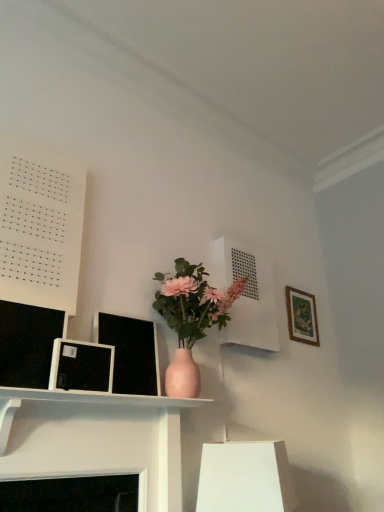
This screenshot has height=512, width=384. What are the coordinates of `matte white shelf at center, placed as the 2th shelf when sorted from back to front` in the screenshot? It's located at (96, 439).

Find the location of a particular element. white matte vent at upper center, which is the first shelf in right-to-left order is located at coordinates (247, 295).

At what (x,y) coordinates should I click in order to perform the action: click on wooden picture frame at upper right, which ranks as the 2th picture frame in front-to-back order. Please return your answer as a coordinate pair (x, y). Looking at the image, I should click on pyautogui.click(x=302, y=317).

Where is `matte black picture frame at left, placed as the second picture frame when sorted from back to front`? This screenshot has width=384, height=512. matte black picture frame at left, placed as the second picture frame when sorted from back to front is located at coordinates (81, 366).

Is wooden picture frame at upper right, which ranks as the 2th picture frame in front-to-back order, oriented away from matte black picture frame at left, placed as the first picture frame when sorted from left to right?

No.

Is wooden picture frame at upper right, which ranks as the 2th picture frame in front-to-back order, wider or thinner than matte black picture frame at left, the second picture frame when ordered from right to left?

Clearly, wooden picture frame at upper right, which ranks as the 2th picture frame in front-to-back order, has less width compared to matte black picture frame at left, the second picture frame when ordered from right to left.

Is wooden picture frame at upper right, positioned as the first picture frame in back-to-front order, bigger than matte black picture frame at left, the second picture frame when ordered from right to left?

Yes.

Which object is wider, white matte vent at upper center, which is the 2th shelf from left to right, or matte white shelf at center, placed as the 2th shelf when sorted from back to front?

With larger width is matte white shelf at center, placed as the 2th shelf when sorted from back to front.

Is white matte vent at upper center, which is the 2th shelf from left to right, far away from matte white shelf at center, the first shelf in the left-to-right sequence?

No, white matte vent at upper center, which is the 2th shelf from left to right, is in close proximity to matte white shelf at center, the first shelf in the left-to-right sequence.

Is white matte vent at upper center, the second shelf viewed from the front, positioned with its back to matte white shelf at center, the first shelf from the front?

No.

Which point is more distant from viewer, (254, 311) or (40, 462)?

The point (254, 311) is more distant.

Are wooden picture frame at upper right, the first picture frame positioned from the right, and white matte vent at upper center, acting as the first shelf starting from the back, making contact?

No, wooden picture frame at upper right, the first picture frame positioned from the right, is not touching white matte vent at upper center, acting as the first shelf starting from the back.

Between wooden picture frame at upper right, the first picture frame positioned from the right, and white matte vent at upper center, the second shelf viewed from the front, which one has smaller size?

wooden picture frame at upper right, the first picture frame positioned from the right, is smaller.

How different are the orientations of wooden picture frame at upper right, which ranks as the 2th picture frame in front-to-back order, and white matte vent at upper center, acting as the first shelf starting from the back, in degrees?

The angle between the facing direction of wooden picture frame at upper right, which ranks as the 2th picture frame in front-to-back order, and the facing direction of white matte vent at upper center, acting as the first shelf starting from the back, is 1.05 degrees.

Based on the photo, is wooden picture frame at upper right, the first picture frame positioned from the right, looking in the opposite direction of white matte vent at upper center, the second shelf viewed from the front?

No, white matte vent at upper center, the second shelf viewed from the front, is not at the back of wooden picture frame at upper right, the first picture frame positioned from the right.

From the picture: Is matte white shelf at center, the first shelf from the front, outside of white paper at upper left?

Absolutely, matte white shelf at center, the first shelf from the front, is external to white paper at upper left.

Is matte white shelf at center, the first shelf in the left-to-right sequence, at the right side of white paper at upper left?

Yes.

Considering the sizes of matte white shelf at center, the first shelf in the left-to-right sequence, and white paper at upper left in the image, is matte white shelf at center, the first shelf in the left-to-right sequence, bigger or smaller than white paper at upper left?

matte white shelf at center, the first shelf in the left-to-right sequence, is bigger than white paper at upper left.

This screenshot has width=384, height=512. In order to click on shelf in front of the white paper at upper left in this screenshot , I will do `click(96, 439)`.

Does white paper at upper left have a lesser height compared to wooden picture frame at upper right, positioned as the first picture frame in back-to-front order?

Incorrect, the height of white paper at upper left does not fall short of that of wooden picture frame at upper right, positioned as the first picture frame in back-to-front order.

Is white paper at upper left facing away from wooden picture frame at upper right, which ranks as the 2th picture frame in front-to-back order?

No.

Is white paper at upper left spatially inside wooden picture frame at upper right, positioned as the first picture frame in back-to-front order, or outside of it?

white paper at upper left lies outside wooden picture frame at upper right, positioned as the first picture frame in back-to-front order.

Identify the location of bulletin board above the wooden picture frame at upper right, positioned as the first picture frame in back-to-front order (from a real-world perspective). (40, 225).

How far apart are matte white shelf at center, arranged as the second shelf when viewed from the right, and wooden picture frame at upper right, positioned as the first picture frame in back-to-front order?

matte white shelf at center, arranged as the second shelf when viewed from the right, and wooden picture frame at upper right, positioned as the first picture frame in back-to-front order, are 1.39 meters apart.

From the image's perspective, is matte white shelf at center, arranged as the second shelf when viewed from the right, on top of wooden picture frame at upper right, positioned as the first picture frame in back-to-front order?

Incorrect, from the image's perspective, matte white shelf at center, arranged as the second shelf when viewed from the right, is lower than wooden picture frame at upper right, positioned as the first picture frame in back-to-front order.

Where is `shelf below the wooden picture frame at upper right, positioned as the first picture frame in back-to-front order (from the image's perspective)`? shelf below the wooden picture frame at upper right, positioned as the first picture frame in back-to-front order (from the image's perspective) is located at coordinates 96,439.

Which is less distant, (x=2, y=460) or (x=291, y=318)?

Positioned in front is point (x=2, y=460).

Is point (295, 315) positioned after point (30, 301)?

Yes, it is behind point (30, 301).

What's the angular difference between wooden picture frame at upper right, which ranks as the 2th picture frame in front-to-back order, and white paper at upper left's facing directions?

1.05 degrees separate the facing orientations of wooden picture frame at upper right, which ranks as the 2th picture frame in front-to-back order, and white paper at upper left.

Is wooden picture frame at upper right, which ranks as the 2th picture frame in front-to-back order, wider or thinner than white paper at upper left?

Considering their sizes, wooden picture frame at upper right, which ranks as the 2th picture frame in front-to-back order, looks slimmer than white paper at upper left.

Locate an element on the screen. The image size is (384, 512). picture frame behind the white paper at upper left is located at coordinates (302, 317).

You are a GUI agent. You are given a task and a screenshot of the screen. Output one action in this format:
    pyautogui.click(x=<x>, y=<y>)
    Task: Click on the picture frame located above the matte black picture frame at left, placed as the second picture frame when sorted from back to front (from a real-world perspective)
    The height and width of the screenshot is (512, 384).
    Given the screenshot: What is the action you would take?
    pyautogui.click(x=302, y=317)

Find the location of a particular element. shelf below the white matte vent at upper center, acting as the first shelf starting from the back (from a real-world perspective) is located at coordinates (96, 439).

When comparing their distances from matte white shelf at center, the first shelf in the left-to-right sequence, does white matte vent at upper center, which is the first shelf in right-to-left order, or matte black picture frame at left, which ranks as the 1th picture frame in front-to-back order, seem further?

white matte vent at upper center, which is the first shelf in right-to-left order, lies further to matte white shelf at center, the first shelf in the left-to-right sequence, than the other object.

Which object lies nearer to the anchor point matte white shelf at center, placed as the 2th shelf when sorted from back to front, white matte vent at upper center, acting as the first shelf starting from the back, or wooden picture frame at upper right, which ranks as the 2th picture frame in front-to-back order?

white matte vent at upper center, acting as the first shelf starting from the back, is closer to matte white shelf at center, placed as the 2th shelf when sorted from back to front.

Estimate the real-world distances between objects in this image. Which object is closer to matte white shelf at center, the first shelf in the left-to-right sequence, white paper at upper left or white matte vent at upper center, which is the 2th shelf from left to right?

Among the two, white paper at upper left is located nearer to matte white shelf at center, the first shelf in the left-to-right sequence.

Looking at the image, which one is located further to matte black picture frame at left, placed as the first picture frame when sorted from left to right, matte white shelf at center, arranged as the second shelf when viewed from the right, or wooden picture frame at upper right, which ranks as the 2th picture frame in front-to-back order?

wooden picture frame at upper right, which ranks as the 2th picture frame in front-to-back order.

Estimate the real-world distances between objects in this image. Which object is further from matte white shelf at center, placed as the 2th shelf when sorted from back to front, wooden picture frame at upper right, positioned as the first picture frame in back-to-front order, or matte black picture frame at left, the second picture frame when ordered from right to left?

wooden picture frame at upper right, positioned as the first picture frame in back-to-front order, lies further to matte white shelf at center, placed as the 2th shelf when sorted from back to front, than the other object.

Considering their positions, is matte black picture frame at left, placed as the second picture frame when sorted from back to front, positioned closer to wooden picture frame at upper right, which ranks as the 2th picture frame in front-to-back order, than matte white shelf at center, arranged as the second shelf when viewed from the right?

matte white shelf at center, arranged as the second shelf when viewed from the right, is positioned closer to the anchor wooden picture frame at upper right, which ranks as the 2th picture frame in front-to-back order.

Which object lies further to the anchor point wooden picture frame at upper right, the second picture frame from the left, white paper at upper left or white matte vent at upper center, the second shelf viewed from the front?

Among the two, white paper at upper left is located further to wooden picture frame at upper right, the second picture frame from the left.

From the image, which object appears to be nearer to white paper at upper left, matte white shelf at center, arranged as the second shelf when viewed from the right, or wooden picture frame at upper right, the first picture frame positioned from the right?

Based on the image, matte white shelf at center, arranged as the second shelf when viewed from the right, appears to be nearer to white paper at upper left.

What are the coordinates of `shelf located between matte black picture frame at left, placed as the first picture frame when sorted from left to right, and wooden picture frame at upper right, the first picture frame positioned from the right, in the depth direction` in the screenshot? It's located at (247, 295).

You are a GUI agent. You are given a task and a screenshot of the screen. Output one action in this format:
    pyautogui.click(x=<x>, y=<y>)
    Task: Click on the picture frame located between white paper at upper left and wooden picture frame at upper right, positioned as the first picture frame in back-to-front order, in the left-right direction
    This screenshot has width=384, height=512.
    Given the screenshot: What is the action you would take?
    pyautogui.click(x=81, y=366)

Find the location of a particular element. The height and width of the screenshot is (512, 384). bulletin board between matte white shelf at center, arranged as the second shelf when viewed from the right, and white matte vent at upper center, which is the 2th shelf from left to right, in the front-back direction is located at coordinates (40, 225).

Identify the location of shelf located between matte white shelf at center, the first shelf from the front, and wooden picture frame at upper right, positioned as the first picture frame in back-to-front order, in the depth direction. (247, 295).